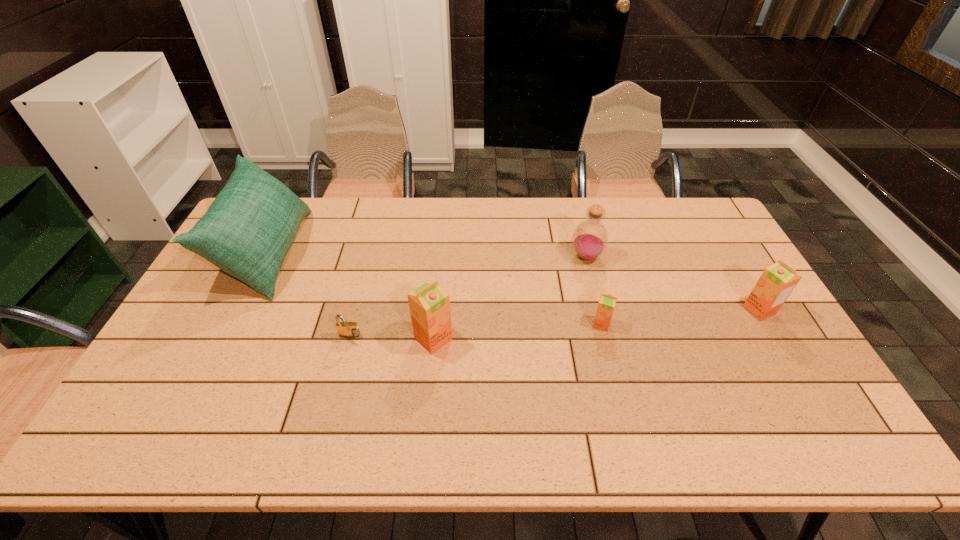
Locate an element on the screen. Image resolution: width=960 pixels, height=540 pixels. vacant area between the leftmost object and the fourth object from right to left is located at coordinates (350, 296).

I want to click on free point between the fifth object from right to left and the bottle, so click(x=468, y=297).

Identify which object is the fourth closest to the shortest orange juice. Please provide its 2D coordinates. Your answer should be formatted as a tuple, i.e. [(x, y)], where the tuple contains the x and y coordinates of a point satisfying the conditions above.

[(345, 329)]

Identify which object is the nearest to the shortest object. Please provide its 2D coordinates. Your answer should be formatted as a tuple, i.e. [(x, y)], where the tuple contains the x and y coordinates of a point satisfying the conditions above.

[(429, 304)]

Identify the location of the closest orange juice relative to the bottle. (607, 302).

Locate which orange juice is the second closest to the second shortest object. Please provide its 2D coordinates. Your answer should be formatted as a tuple, i.e. [(x, y)], where the tuple contains the x and y coordinates of a point satisfying the conditions above.

[(776, 283)]

You are a GUI agent. You are given a task and a screenshot of the screen. Output one action in this format:
    pyautogui.click(x=<x>, y=<y>)
    Task: Click on the vacant space that satisfies the following two spatial constraints: 1. on the front-facing side of the second shortest object; 2. on the right side of the leftmost object
    The height and width of the screenshot is (540, 960).
    Given the screenshot: What is the action you would take?
    pyautogui.click(x=230, y=324)

This screenshot has height=540, width=960. I want to click on vacant point that satisfies the following two spatial constraints: 1. on the front-facing side of the leftmost object; 2. on the right side of the leftmost orange juice, so click(x=223, y=339).

Identify the location of vacant area in the image that satisfies the following two spatial constraints: 1. on the front-facing side of the rightmost object; 2. on the left side of the cushion. This screenshot has width=960, height=540. (238, 310).

At what (x,y) coordinates should I click in order to perform the action: click on vacant space that satisfies the following two spatial constraints: 1. on the front-facing side of the bottle; 2. on the left side of the tallest object. Please return your answer as a coordinate pair (x, y). Image resolution: width=960 pixels, height=540 pixels. Looking at the image, I should click on (265, 256).